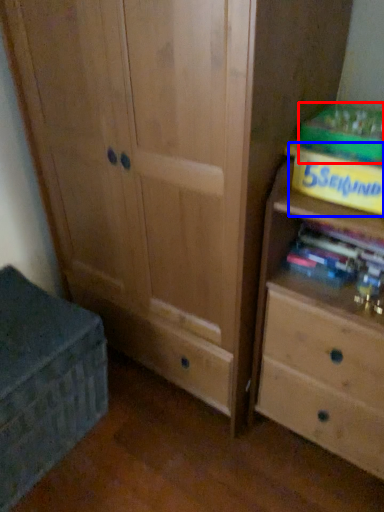
Question: Which object appears closest to the camera in this image, paperback book (highlighted by a red box) or paperback book (highlighted by a blue box)?

Choices:
 (A) paperback book
 (B) paperback book

Answer: (B)